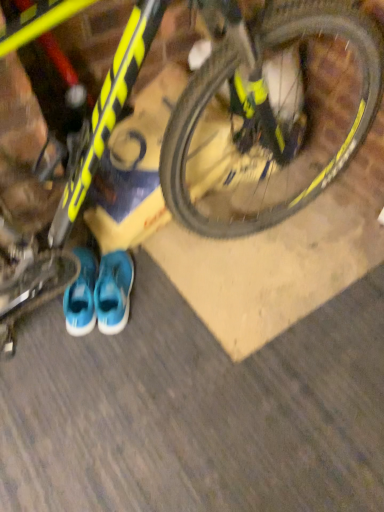
What are the coordinates of `free spot to the right of blue fabric sneakers at lower center` in the screenshot? It's located at (149, 288).